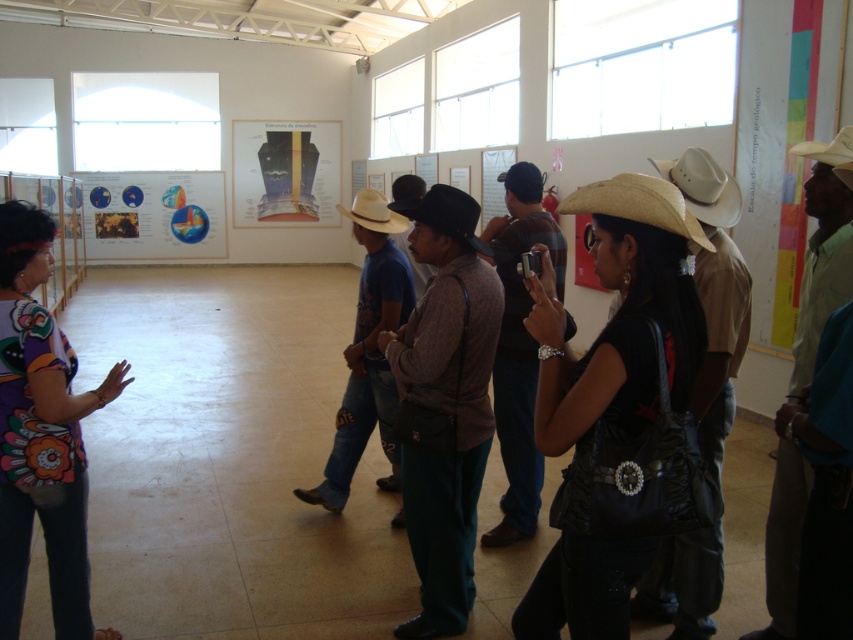
Question: Which point is closer to the camera taking this photo?

Choices:
 (A) (x=42, y=365)
 (B) (x=798, y=152)
 (C) (x=701, y=216)

Answer: (A)

Question: From the image, what is the correct spatial relationship of black felt cowboy hat at center in relation to light brown straw cowboy hat at center?

Choices:
 (A) left
 (B) right

Answer: (B)

Question: Is natural straw cowboy hat at center bigger than black felt cowboy hat at center?

Choices:
 (A) no
 (B) yes

Answer: (A)

Question: Which of the following is the farthest from the observer?

Choices:
 (A) black felt cowboy hat at center
 (B) natural straw cowboy hat at center

Answer: (A)

Question: Can you confirm if printed fabric blouse at left is positioned above white matte cowboy hat at upper right?

Choices:
 (A) no
 (B) yes

Answer: (A)

Question: Among these objects, which one is farthest from the camera?

Choices:
 (A) black felt cowboy hat at center
 (B) natural straw cowboy hat at center

Answer: (A)